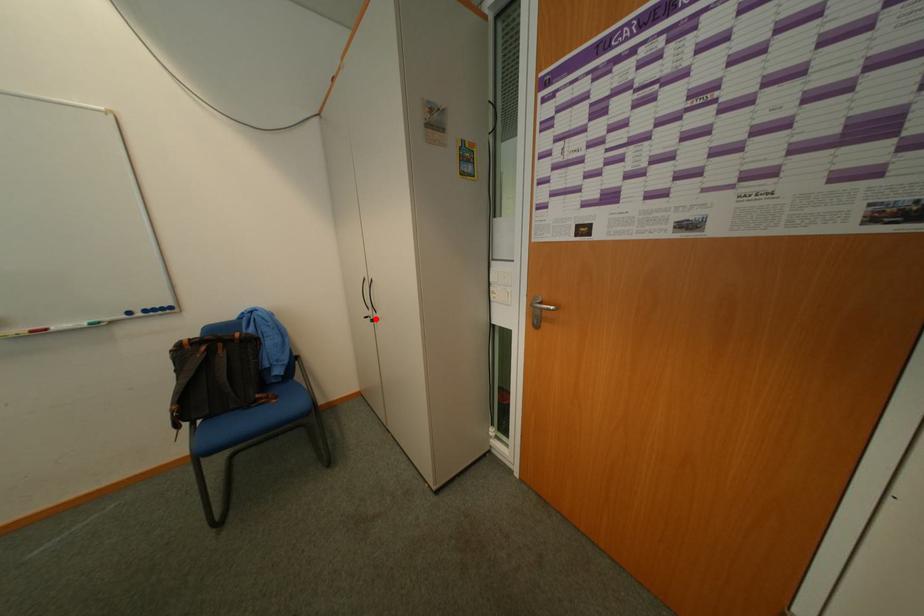
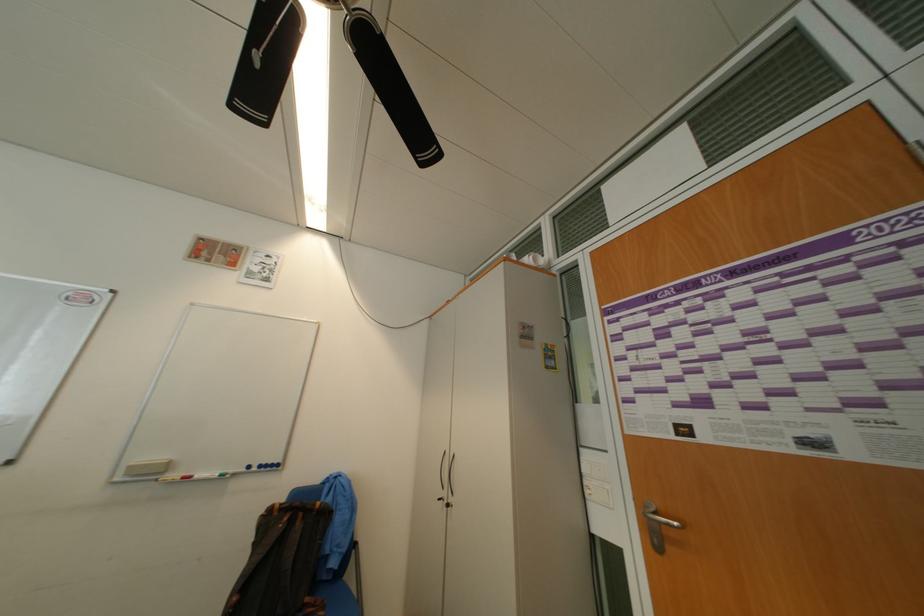
In the second image, find the point that corresponds to the highlighted location in the first image.

(448, 501)